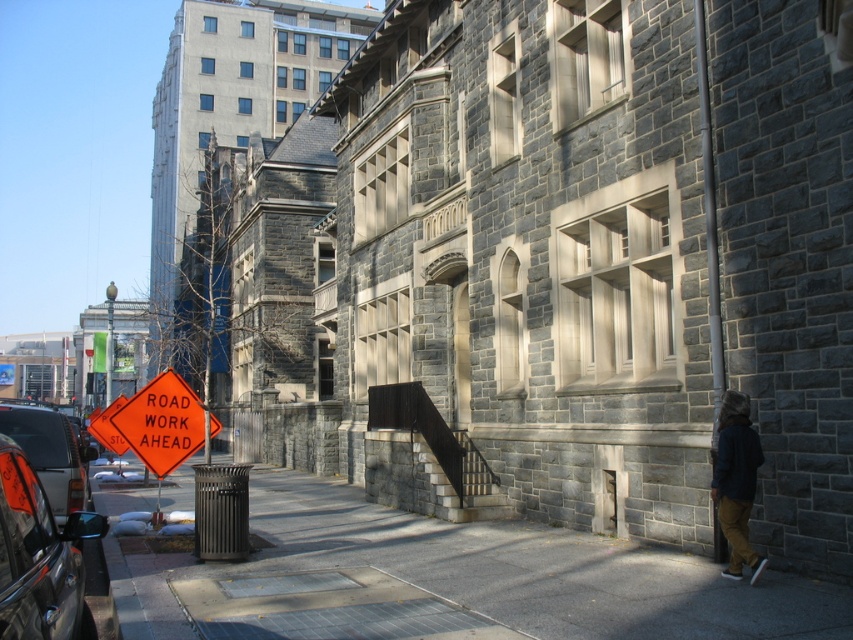
Is orange plastic sign at lower left closer to the viewer compared to dark blue jacket at lower right?

No.

Which is in front, point (167, 456) or point (741, 547)?

Point (741, 547)

Measure the distance between point (154, 429) and camera.

36.01 feet

Where is `orange plastic sign at lower left`? orange plastic sign at lower left is located at coordinates (163, 422).

Who is higher up, orange plastic sign at lower left or matte black car at left?

Positioned higher is orange plastic sign at lower left.

I want to click on orange plastic sign at lower left, so click(163, 422).

Which of these two, smooth concrete pavement at lower center or shiny black car at left, stands taller?

smooth concrete pavement at lower center is taller.

Find the location of a particular element. The width and height of the screenshot is (853, 640). smooth concrete pavement at lower center is located at coordinates tap(457, 579).

Is point (331, 522) more distant than point (100, 531)?

Yes, it is behind point (100, 531).

You are a GUI agent. You are given a task and a screenshot of the screen. Output one action in this format:
    pyautogui.click(x=<x>, y=<y>)
    Task: Click on the smooth concrete pavement at lower center
    The image size is (853, 640).
    Given the screenshot: What is the action you would take?
    pyautogui.click(x=457, y=579)